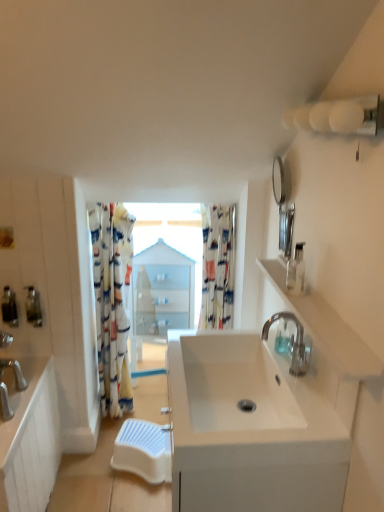
Identify the location of free space above white glossy sink at right (from a real-world perspective). (316, 301).